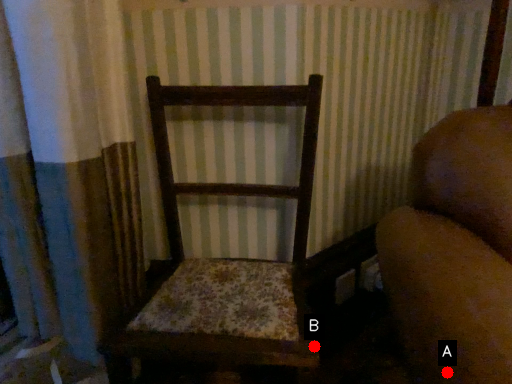
Question: Two points are circled on the image, labeled by A and B beside each circle. Which point is closer to the camera?

Choices:
 (A) A is closer
 (B) B is closer

Answer: (A)